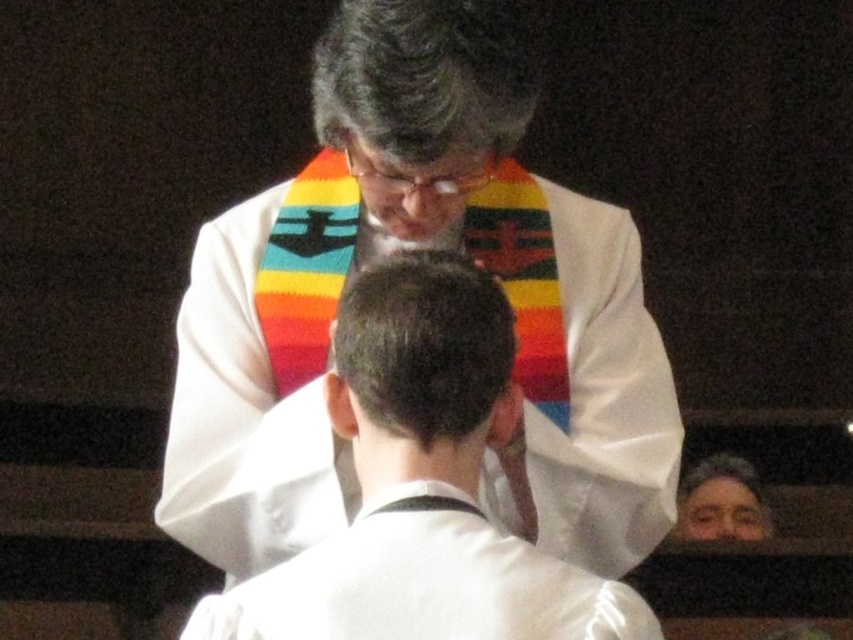
Question: Which point appears farthest from the camera in this image?

Choices:
 (A) (402, 156)
 (B) (474, 598)
 (C) (519, 54)

Answer: (A)

Question: Is white woolen scarf at upper center wider than white satin robe at center?

Choices:
 (A) yes
 (B) no

Answer: (A)

Question: Can you confirm if white satin robe at center is positioned to the left of multicolored knitted scarf at center?

Choices:
 (A) yes
 (B) no

Answer: (B)

Question: Which of the following is the farthest from the observer?

Choices:
 (A) (465, 355)
 (B) (289, 228)

Answer: (B)

Question: Can you confirm if white satin robe at center is positioned to the right of brown hair at center?

Choices:
 (A) no
 (B) yes

Answer: (B)

Question: Which object appears farthest from the camera in this image?

Choices:
 (A) white satin robe at center
 (B) multicolored knitted scarf at center
 (C) white woolen scarf at upper center

Answer: (C)